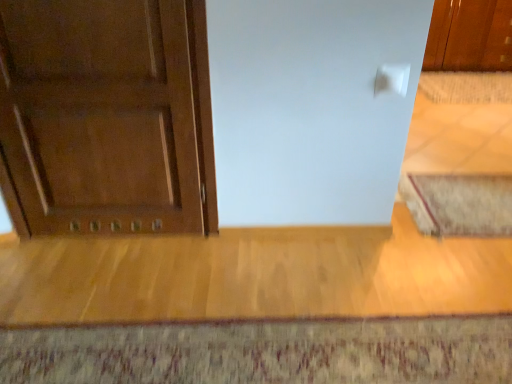
This screenshot has height=384, width=512. I want to click on free point below textured wool doormat at lower center, which ranks as the third doormat in right-to-left order (from a real-world perspective), so click(x=281, y=354).